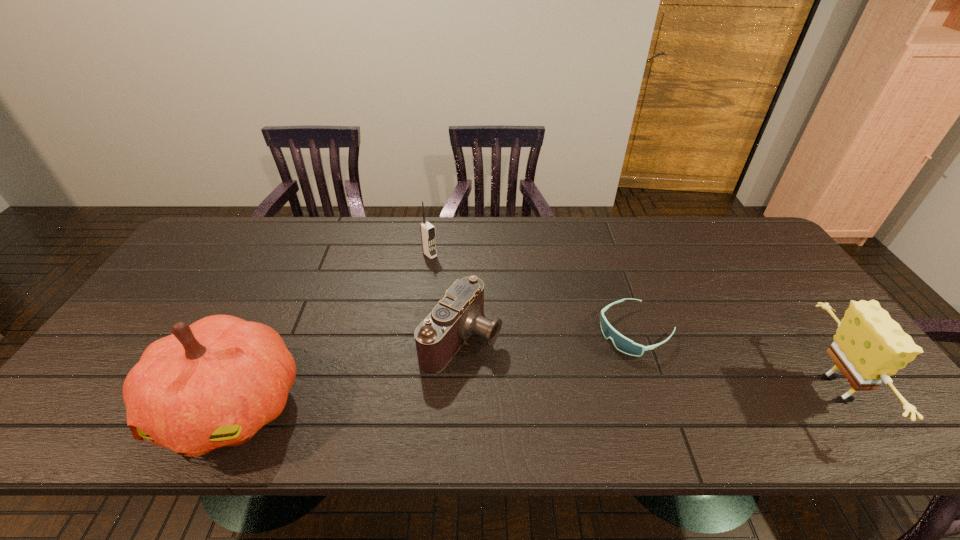
Find the location of `sponge that is at the near edge`. sponge that is at the near edge is located at coordinates (869, 346).

Where is `camera at the near edge`? This screenshot has height=540, width=960. camera at the near edge is located at coordinates (460, 314).

The width and height of the screenshot is (960, 540). Identify the location of object that is positioned at the right edge. (869, 346).

You are a GUI agent. You are given a task and a screenshot of the screen. Output one action in this format:
    pyautogui.click(x=<x>, y=<y>)
    Task: Click on the object at the near right corner
    The width and height of the screenshot is (960, 540).
    Given the screenshot: What is the action you would take?
    pyautogui.click(x=869, y=346)

The height and width of the screenshot is (540, 960). Find the location of `vacant space at the far edge of the desktop`. vacant space at the far edge of the desktop is located at coordinates (609, 217).

The height and width of the screenshot is (540, 960). I want to click on vacant space at the near edge, so click(474, 391).

Find the location of a particular element. This screenshot has width=960, height=540. vacant space at the right edge of the desktop is located at coordinates (815, 319).

The width and height of the screenshot is (960, 540). I want to click on vacant space at the far left corner of the desktop, so click(236, 225).

You are a GUI agent. You are given a task and a screenshot of the screen. Output one action in this format:
    pyautogui.click(x=<x>, y=<y>)
    Task: Click on the vacant space at the near left corner of the desktop
    
    Given the screenshot: What is the action you would take?
    pyautogui.click(x=98, y=382)

In the image, there is a desktop. Identify the location of vacant space at the far right corner. This screenshot has height=540, width=960. (736, 258).